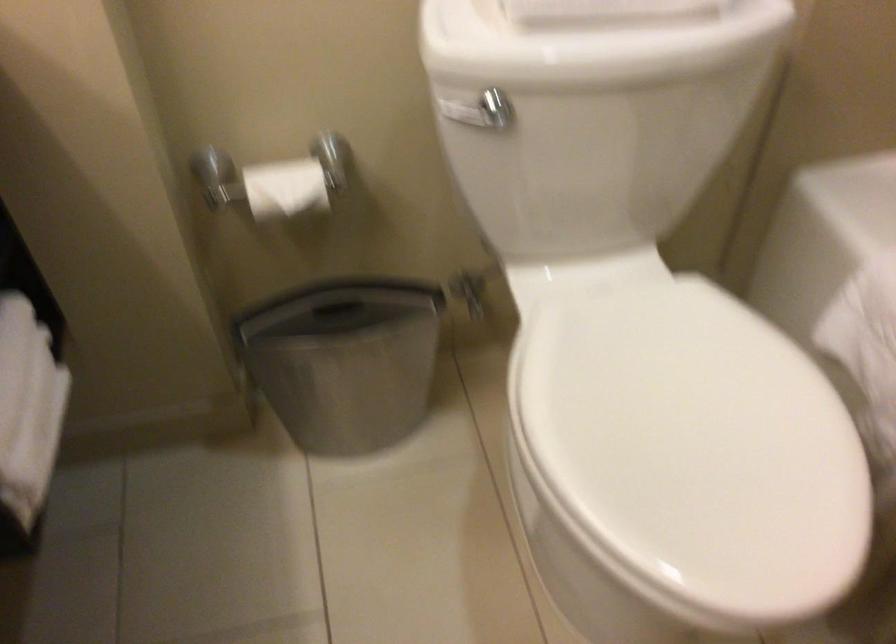
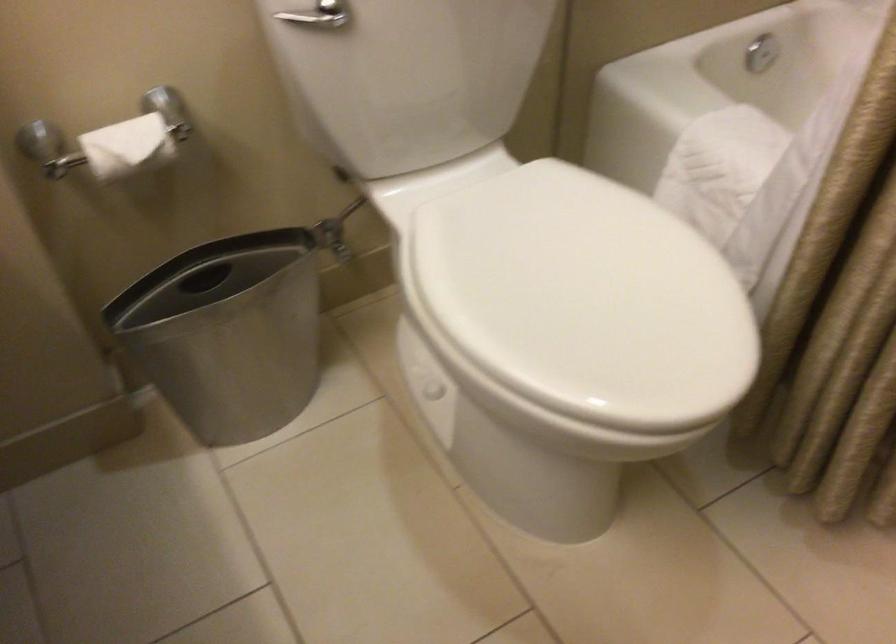
Where in the second image is the point corresponding to point (467, 104) from the first image?

(305, 17)